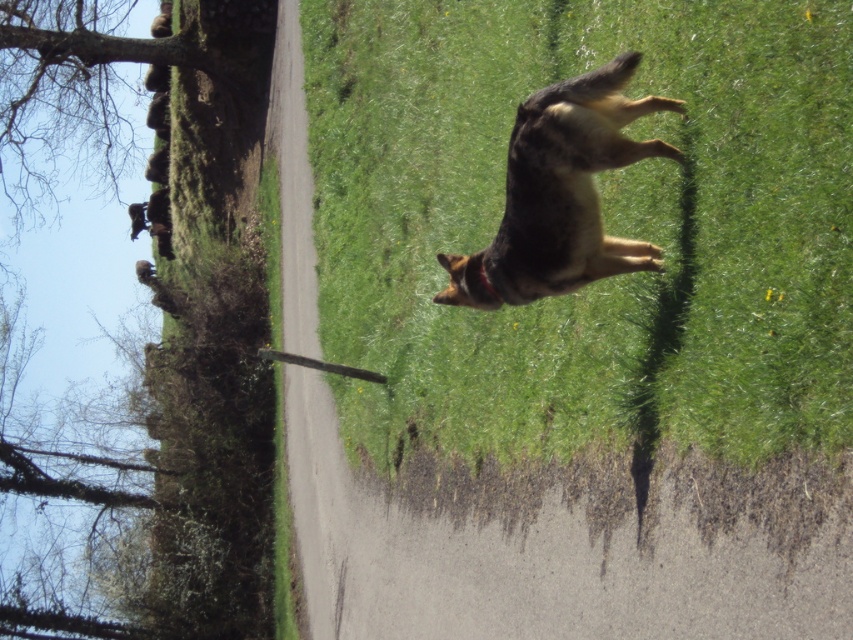
Is dark brown fur dog at center to the left of bare wood tree at upper left from the viewer's perspective?

Incorrect, dark brown fur dog at center is not on the left side of bare wood tree at upper left.

Who is shorter, dark brown fur dog at center or bare wood tree at upper left?

Standing shorter between the two is dark brown fur dog at center.

This screenshot has height=640, width=853. Identify the location of dark brown fur dog at center. (560, 193).

The image size is (853, 640). Identify the location of dark brown fur dog at center. (560, 193).

Is green grass at upper right to the left of dark brown fur dog at center from the viewer's perspective?

Indeed, green grass at upper right is positioned on the left side of dark brown fur dog at center.

Where is `green grass at upper right`? Image resolution: width=853 pixels, height=640 pixels. green grass at upper right is located at coordinates (604, 221).

Image resolution: width=853 pixels, height=640 pixels. What do you see at coordinates (604, 221) in the screenshot?
I see `green grass at upper right` at bounding box center [604, 221].

Locate an element on the screen. This screenshot has width=853, height=640. green grass at upper right is located at coordinates pos(604,221).

Who is higher up, green grass at upper right or bare wood tree at upper left?

bare wood tree at upper left is above.

Can you confirm if green grass at upper right is thinner than bare wood tree at upper left?

Correct, green grass at upper right's width is less than bare wood tree at upper left's.

Is point (791, 88) farther from viewer compared to point (90, 120)?

That is False.

Locate an element on the screen. The width and height of the screenshot is (853, 640). green grass at upper right is located at coordinates (604, 221).